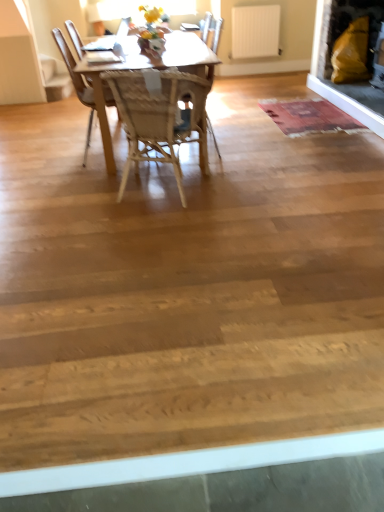
Find the location of `vacant location below woven wood chair at center, the 2th chair when ordered from back to front (from a real-world perspective)`. vacant location below woven wood chair at center, the 2th chair when ordered from back to front (from a real-world perspective) is located at coordinates (170, 184).